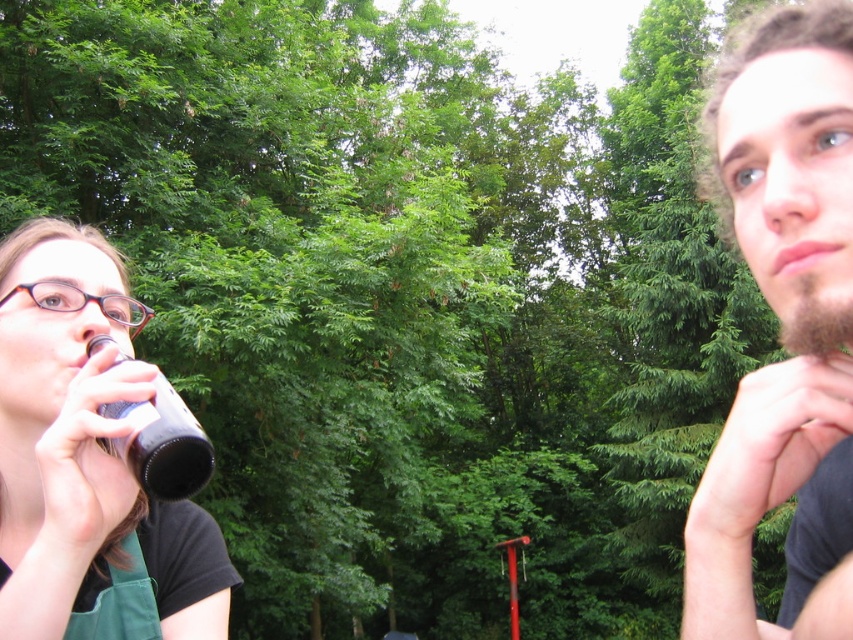
What are the coordinates of the dark brown beard at right?

The dark brown beard at right is located at coordinates point [782,324].

You are a photographer trying to capture a closeup of the dark brown beard at right and the black matte bottle at left. Since you want both subjects in focus, you need to know their distance apart. Can you tell me which one is closer to the camera?

The dark brown beard at right is positioned on the right side of the black matte bottle at left, so the dark brown beard at right is closer to the camera than the black matte bottle at left.

You are organizing a picnic and have two bottles, a matte black bottle at left and a black matte bottle at left. Which one can hold more liquid?

The matte black bottle at left has a larger size compared to the black matte bottle at left, so it can hold more liquid.